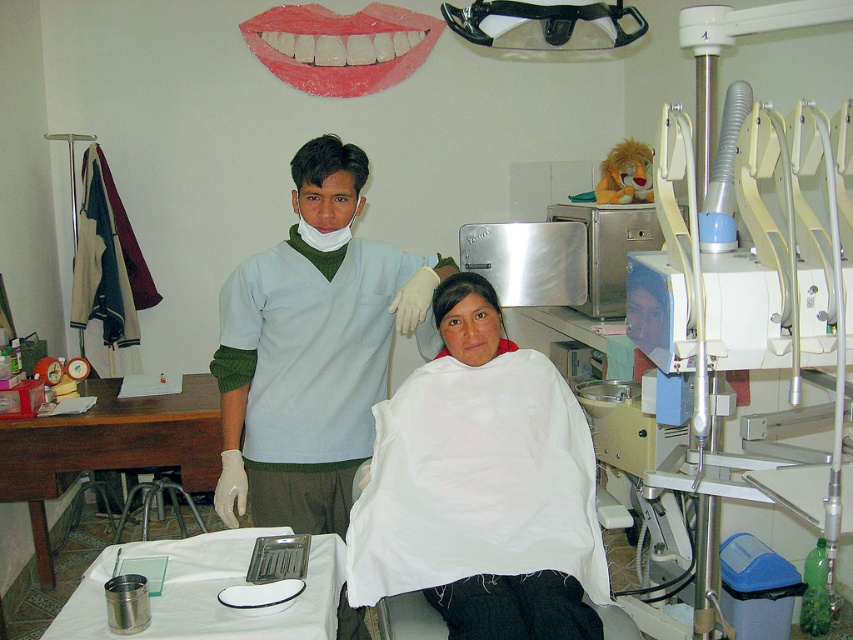
You are a dental assistant preparing to place a mouthguard into the patient. The mouthguard is designed to fit the shiny plastic mouth at upper center. However, you notice the pink matte lips at upper center. Which object should you align the mouthguard with to ensure proper fit?

The mouthguard should be aligned with the shiny plastic mouth at upper center because it is wider than the pink matte lips at upper center, ensuring a better fit.

You are a patient in a dental clinic and see the light blue scrubs at center and the dark brown hair at center. Which one is located lower in the image?

The light blue scrubs at center is positioned under dark brown hair at center, so it is located lower in the image.

You are a patient in a dental clinic and you want to see the light blue scrubs at center and the pink matte lips at upper center. Which one is higher in the image?

The light blue scrubs at center is much taller than pink matte lips at upper center, so the light blue scrubs at center is higher in the image.